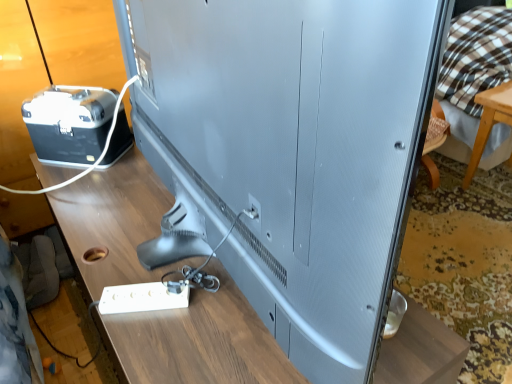
Where is `free spot behind white plastic extension cord at lower left`? free spot behind white plastic extension cord at lower left is located at coordinates (140, 258).